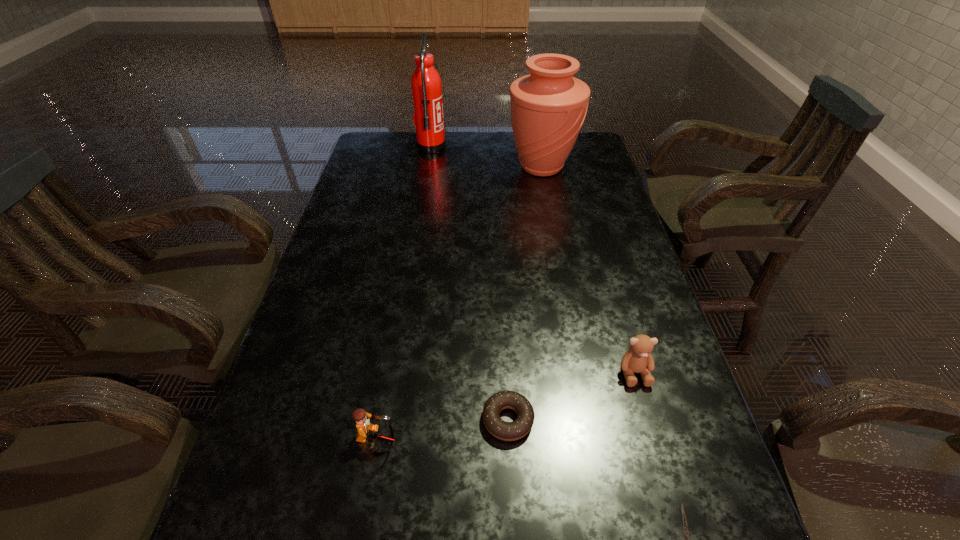
Locate an element on the screen. Image resolution: width=960 pixels, height=540 pixels. fire extinguisher present at the far edge is located at coordinates [426, 86].

The image size is (960, 540). Identify the location of vase that is at the far edge. (548, 107).

The width and height of the screenshot is (960, 540). Find the location of `vase present at the right edge`. vase present at the right edge is located at coordinates (548, 107).

Where is `teddy bear at the right edge`? The height and width of the screenshot is (540, 960). teddy bear at the right edge is located at coordinates (638, 359).

You are a GUI agent. You are given a task and a screenshot of the screen. Output one action in this format:
    pyautogui.click(x=<x>, y=<y>)
    Task: Click on the object situated at the far right corner
    The height and width of the screenshot is (540, 960).
    Given the screenshot: What is the action you would take?
    pyautogui.click(x=548, y=107)

In the image, there is a desktop. Where is `blank space at the left edge`? The image size is (960, 540). blank space at the left edge is located at coordinates (364, 286).

I want to click on free location at the right edge, so click(625, 340).

This screenshot has height=540, width=960. What are the coordinates of `free space at the far left corner` in the screenshot? It's located at [370, 142].

You are a GUI agent. You are given a task and a screenshot of the screen. Output one action in this format:
    pyautogui.click(x=<x>, y=<y>)
    Task: Click on the free spot between the teddy bear and the fire extinguisher
    
    Given the screenshot: What is the action you would take?
    pyautogui.click(x=533, y=260)

You are a GUI agent. You are given a task and a screenshot of the screen. Output one action in this format:
    pyautogui.click(x=<x>, y=<y>)
    Task: Click on the free space between the doughnut and the Lego
    
    Given the screenshot: What is the action you would take?
    pyautogui.click(x=443, y=429)